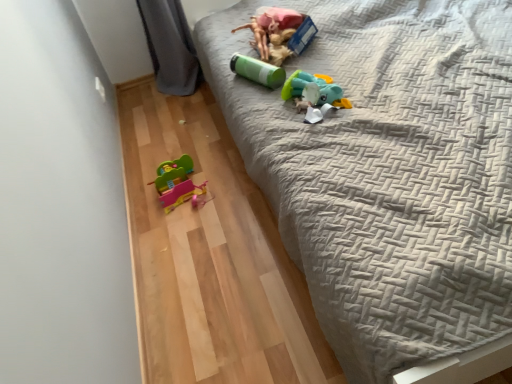
Question: Do you think matte green plastic cup at upper center, which is the first toy in top-to-bottom order, is within gray quilted bed at upper right, or outside of it?

Choices:
 (A) outside
 (B) inside

Answer: (B)

Question: From a real-world perspective, relative to gray quilted bed at upper right, is matte green plastic cup at upper center, which is the first toy in top-to-bottom order, vertically above or below?

Choices:
 (A) above
 (B) below

Answer: (A)

Question: Which is farther from the matte green plastic cup at upper center, which is the first toy in top-to-bottom order?

Choices:
 (A) matte plastic toy car at lower left, which is counted as the 4th toy, starting from the top
 (B) teal matte plush toy at upper center, acting as the third toy starting from the top
 (C) gray quilted bed at upper right
 (D) green matte canister at upper center, the second toy in the top-to-bottom sequence

Answer: (A)

Question: Based on their relative distances, which object is nearer to the gray quilted bed at upper right?

Choices:
 (A) matte green plastic cup at upper center, which is the first toy in top-to-bottom order
 (B) matte plastic toy car at lower left, which is counted as the 4th toy, starting from the top
 (C) teal matte plush toy at upper center, which is counted as the second toy, starting from the bottom
 (D) green matte canister at upper center, the second toy in the top-to-bottom sequence

Answer: (C)